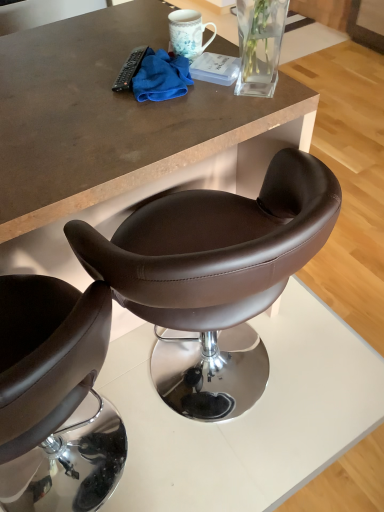
I want to click on free spot to the right of brown leather chair at center, so click(333, 354).